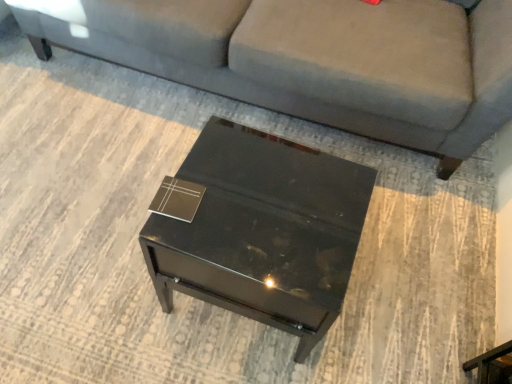
Where is `vacant area to the right of matte black book at center`? The width and height of the screenshot is (512, 384). vacant area to the right of matte black book at center is located at coordinates (244, 205).